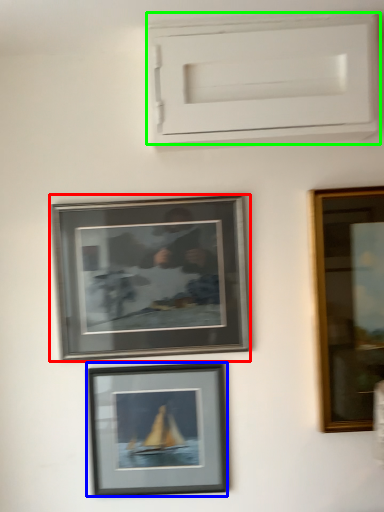
Question: Which is farther away from picture frame (highlighted by a red box)? picture frame (highlighted by a blue box) or window frame (highlighted by a green box)?

Choices:
 (A) picture frame
 (B) window frame

Answer: (B)